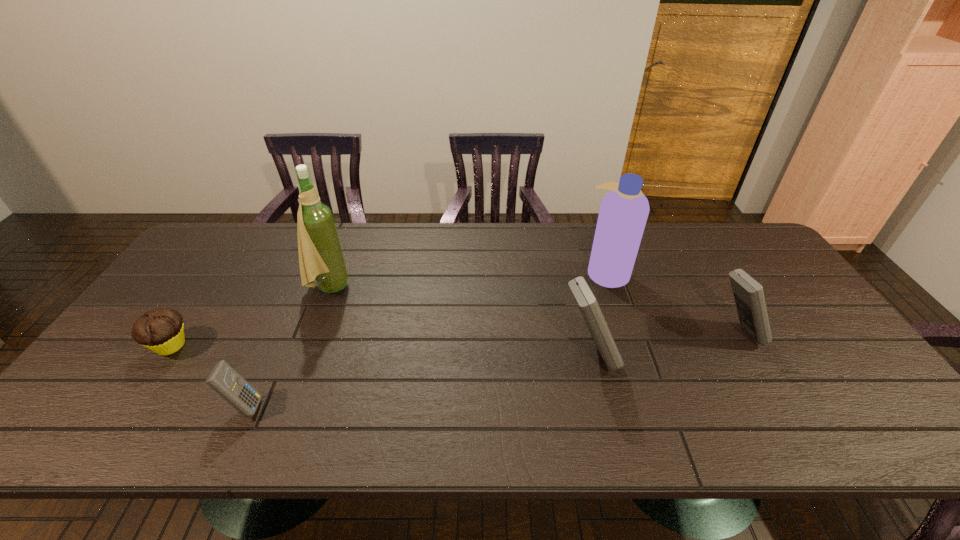
Locate an element on the screen. empty location between the muffin and the wine bottle is located at coordinates (250, 316).

Locate an element on the screen. This screenshot has width=960, height=540. vacant space that is in between the second calculator from right to left and the wine bottle is located at coordinates (459, 321).

I want to click on free space that is in between the second shortest calculator and the second tallest object, so click(x=671, y=303).

This screenshot has width=960, height=540. Identify the location of vacant space that's between the wine bottle and the second tallest object. (468, 280).

At what (x,y) coordinates should I click in order to perform the action: click on free space between the second shortest calculator and the shortest object. Please return your answer as a coordinate pair (x, y). The width and height of the screenshot is (960, 540). Looking at the image, I should click on (453, 340).

Identify the location of free spot between the third shortest object and the wine bottle. The width and height of the screenshot is (960, 540). (533, 310).

In order to click on free space between the second shortest calculator and the leftmost calculator in this screenshot , I will do `click(491, 370)`.

Identify the location of free space between the second tallest calculator and the muffin. (453, 340).

The image size is (960, 540). Identify the location of object that is the fourth closest one to the shampoo. (223, 379).

This screenshot has height=540, width=960. I want to click on object that can be found as the second closest to the shortest object, so tap(321, 258).